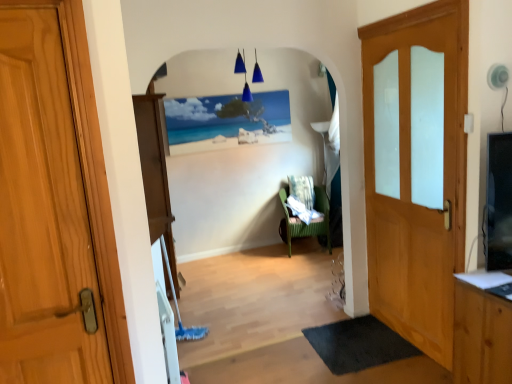
Question: Is green wicker chair at center further to the viewer compared to wooden door with frosted glass panels at right, which appears as the 1th door when viewed from the back?

Choices:
 (A) yes
 (B) no

Answer: (A)

Question: From a real-world perspective, is green wicker chair at center located beneath wooden door with frosted glass panels at right, which appears as the 1th door when viewed from the back?

Choices:
 (A) no
 (B) yes

Answer: (B)

Question: From a real-world perspective, does green wicker chair at center stand above wooden door with frosted glass panels at right, which appears as the 1th door when viewed from the back?

Choices:
 (A) yes
 (B) no

Answer: (B)

Question: Can you confirm if green wicker chair at center is taller than wooden door with frosted glass panels at right, which appears as the 1th door when viewed from the back?

Choices:
 (A) yes
 (B) no

Answer: (B)

Question: Can you confirm if green wicker chair at center is shorter than wooden door with frosted glass panels at right, the 2th door positioned from the left?

Choices:
 (A) yes
 (B) no

Answer: (A)

Question: Is green wicker chair at center facing away from wooden door with frosted glass panels at right, the 2th door positioned from the left?

Choices:
 (A) yes
 (B) no

Answer: (B)

Question: From a real-world perspective, is black rubber mat at lower right beneath wooden door with frosted glass panels at right, the 1th door in the right-to-left sequence?

Choices:
 (A) yes
 (B) no

Answer: (A)

Question: Does black rubber mat at lower right have a smaller size compared to wooden door with frosted glass panels at right, placed as the second door when sorted from front to back?

Choices:
 (A) yes
 (B) no

Answer: (A)

Question: Is black rubber mat at lower right positioned before wooden door with frosted glass panels at right, the 2th door positioned from the left?

Choices:
 (A) yes
 (B) no

Answer: (B)

Question: Does black rubber mat at lower right have a lesser width compared to wooden door with frosted glass panels at right, the 2th door positioned from the left?

Choices:
 (A) no
 (B) yes

Answer: (A)

Question: Is black rubber mat at lower right positioned with its back to wooden door with frosted glass panels at right, which appears as the 1th door when viewed from the back?

Choices:
 (A) yes
 (B) no

Answer: (B)

Question: Is wooden door with frosted glass panels at right, the 1th door in the right-to-left sequence, inside black rubber mat at lower right?

Choices:
 (A) no
 (B) yes

Answer: (A)

Question: Is wooden door with frosted glass panels at right, placed as the second door when sorted from front to back, beside wooden door at left, which is the second door in back-to-front order?

Choices:
 (A) no
 (B) yes

Answer: (A)